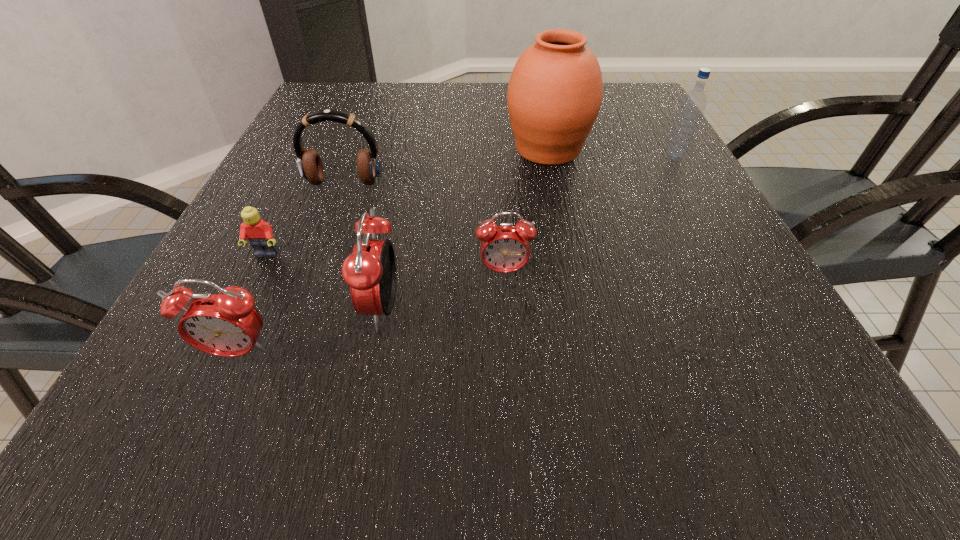
Locate an element on the screen. This screenshot has width=960, height=540. object that is at the right edge is located at coordinates (690, 112).

Find the location of a particular element. object at the near left corner is located at coordinates (226, 324).

Locate an element on the screen. vacant region at the far edge is located at coordinates (445, 118).

At what (x,y) coordinates should I click in order to perform the action: click on free space at the near edge of the desktop. Please return your answer as a coordinate pair (x, y). The width and height of the screenshot is (960, 540). Looking at the image, I should click on (631, 355).

The image size is (960, 540). I want to click on free spot at the left edge of the desktop, so click(x=342, y=173).

In order to click on vacant point at the right edge in this screenshot , I will do pos(623,169).

At what (x,y) coordinates should I click in order to perform the action: click on blank space at the far right corner of the desktop. Please return your answer as a coordinate pair (x, y). Image resolution: width=960 pixels, height=540 pixels. Looking at the image, I should click on (607, 104).

I want to click on unoccupied position between the shortest object and the tallest object, so click(407, 202).

The height and width of the screenshot is (540, 960). I want to click on unoccupied area between the headset and the water bottle, so click(510, 171).

I want to click on empty space between the headset and the second shortest alarm clock, so click(292, 268).